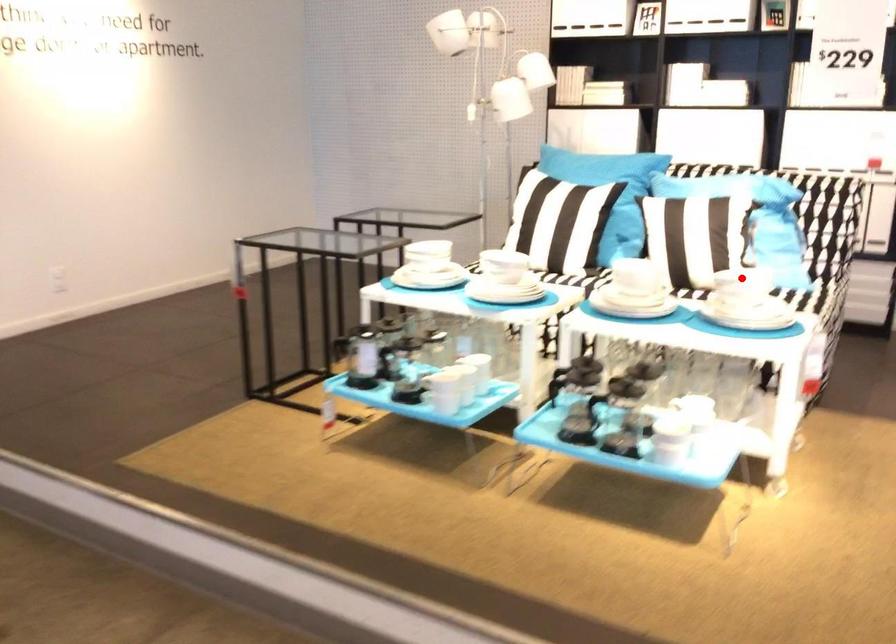
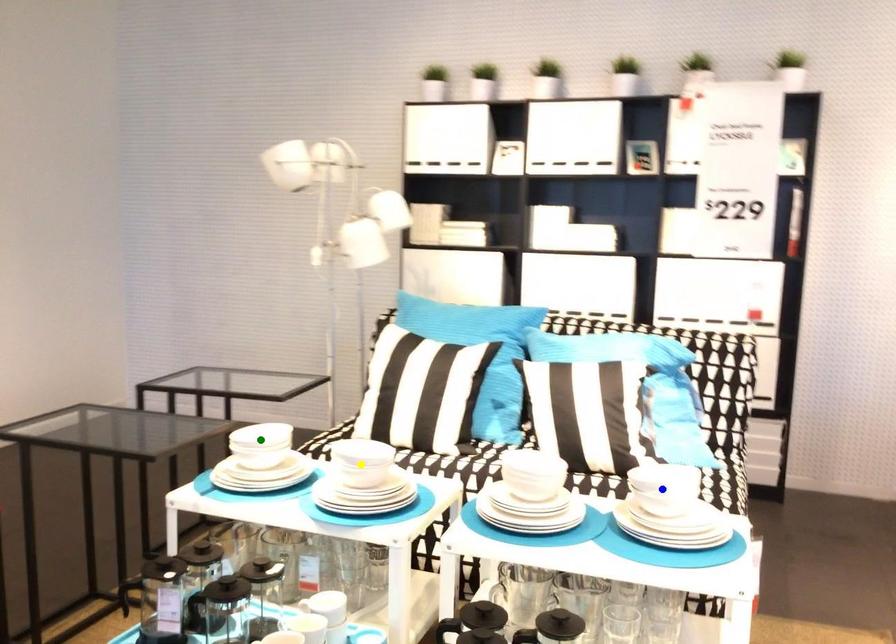
Question: I am providing you with two images of the same scene from different viewpoints. A red point is marked on the first image. You are given multiple points on the second image. Which mark in image 2 goes with the point in image 1?

Choices:
 (A) yellow point
 (B) green point
 (C) blue point

Answer: (C)